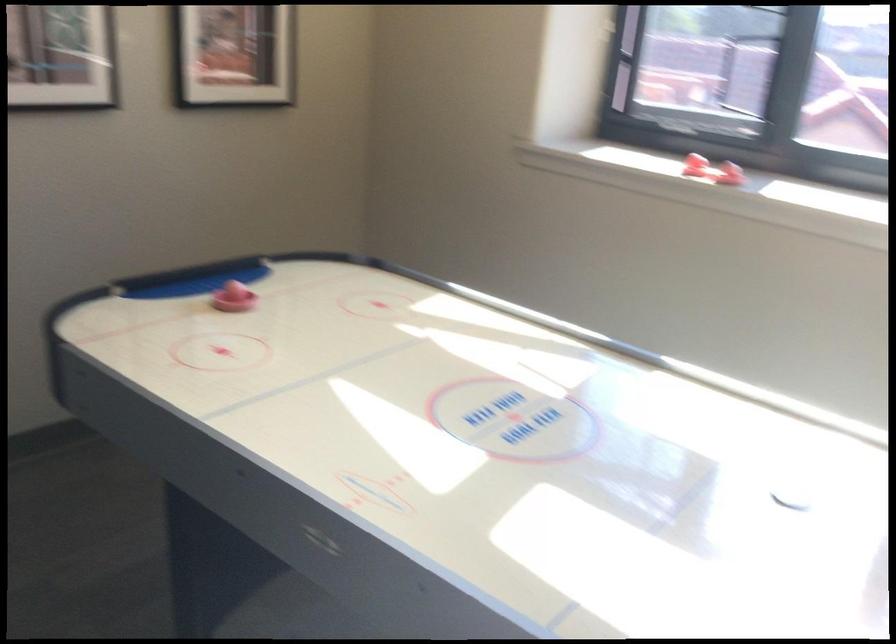
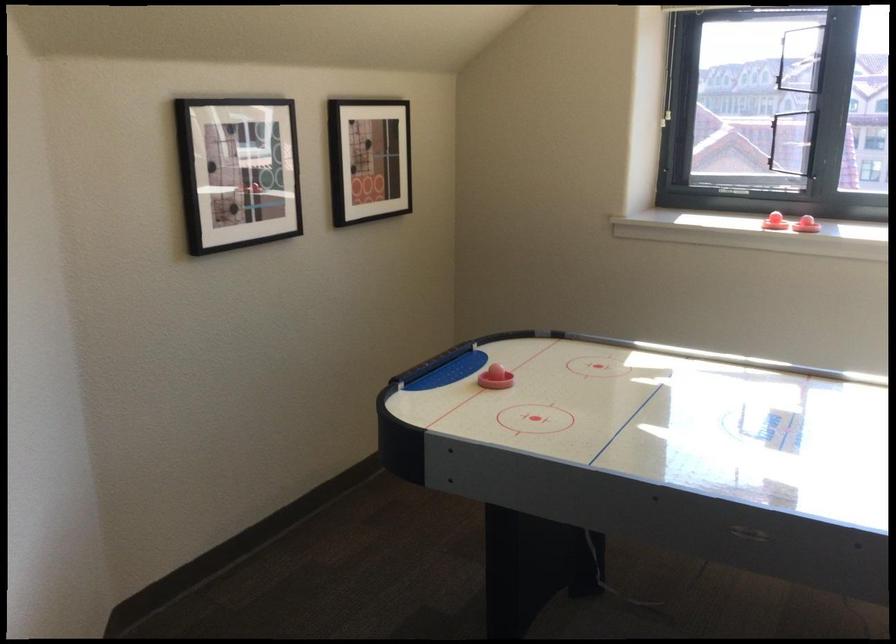
The point at (714, 185) is marked in the first image. Where is the corresponding point in the second image?

(806, 225)